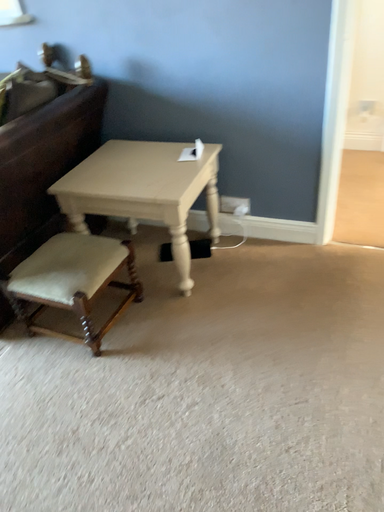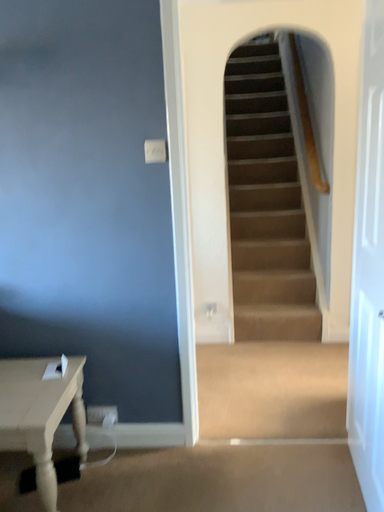
Question: How did the camera likely rotate when shooting the video?

Choices:
 (A) rotated right
 (B) rotated left

Answer: (A)